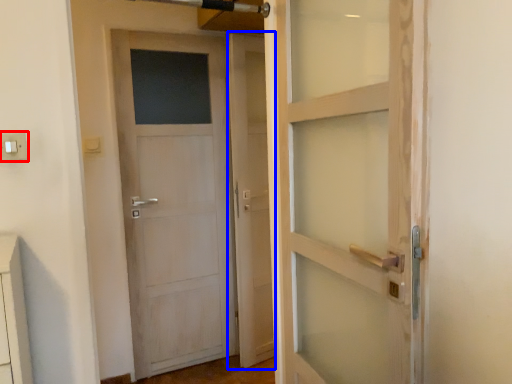
Question: Which point is closer to the camera, electric outlet (highlighted by a red box) or screen door (highlighted by a blue box)?

Choices:
 (A) electric outlet
 (B) screen door

Answer: (A)